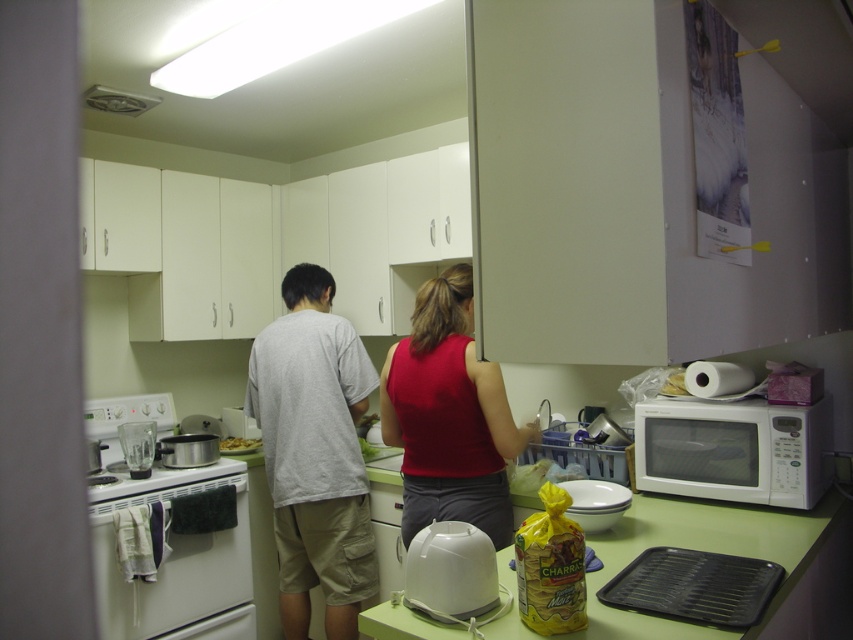
Is point (204, 609) farther from camera compared to point (259, 440)?

No.

Between white glossy oven at lower left and shiny silver pot at center, which one has less height?

With less height is shiny silver pot at center.

The width and height of the screenshot is (853, 640). Find the location of `white glossy oven at lower left`. white glossy oven at lower left is located at coordinates (173, 561).

Between shiny silver pot at center and white plastic plate at center, which one is positioned lower?

Positioned lower is shiny silver pot at center.

Can you confirm if shiny silver pot at center is thinner than white plastic plate at center?

No, shiny silver pot at center is not thinner than white plastic plate at center.

What are the coordinates of `shiny silver pot at center` in the screenshot? It's located at (238, 444).

Who is shorter, white matte microwave at right or white plastic plate at center?

With less height is white plastic plate at center.

What are the coordinates of `white matte microwave at right` in the screenshot? It's located at (733, 449).

At what (x,y) coordinates should I click in order to perform the action: click on white matte microwave at right. Please return your answer as a coordinate pair (x, y). The height and width of the screenshot is (640, 853). Looking at the image, I should click on (733, 449).